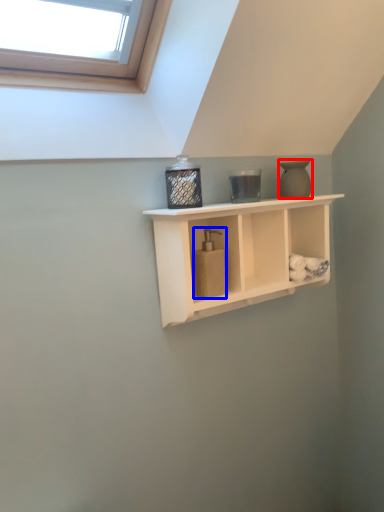
Question: Which object appears closest to the camera in this image, vase (highlighted by a red box) or soap dispenser (highlighted by a blue box)?

Choices:
 (A) vase
 (B) soap dispenser

Answer: (B)